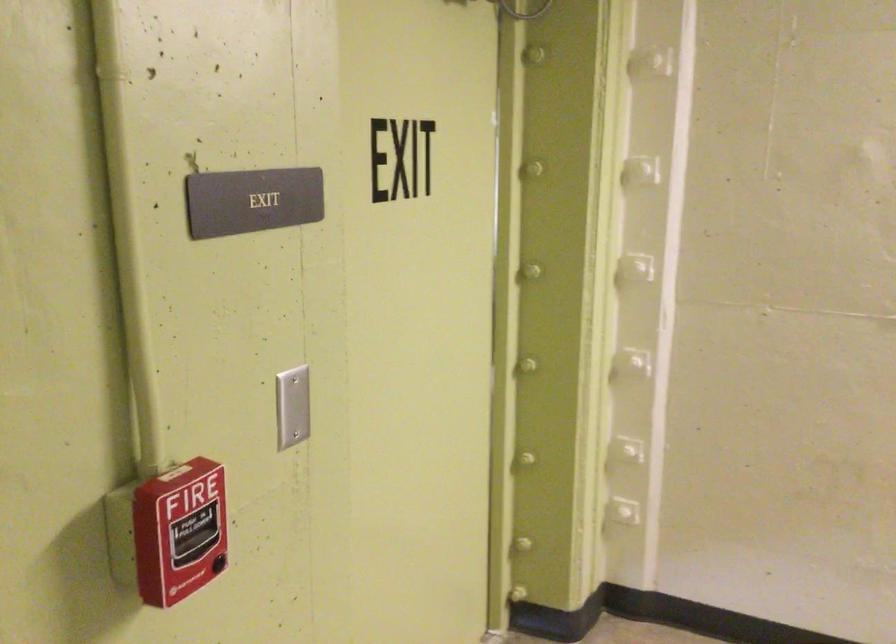
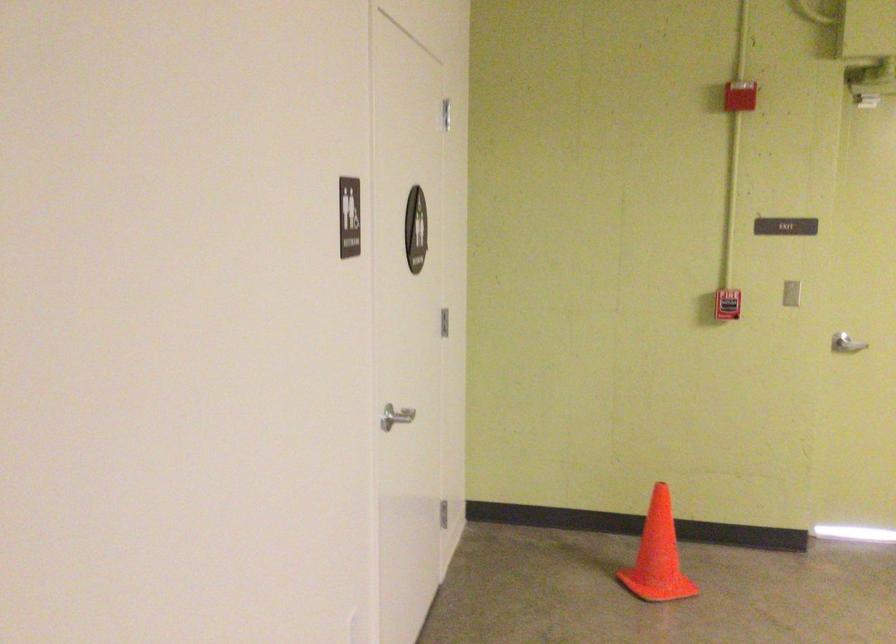
In the second image, find the point that corresponds to [305,504] in the first image.

(846, 344)